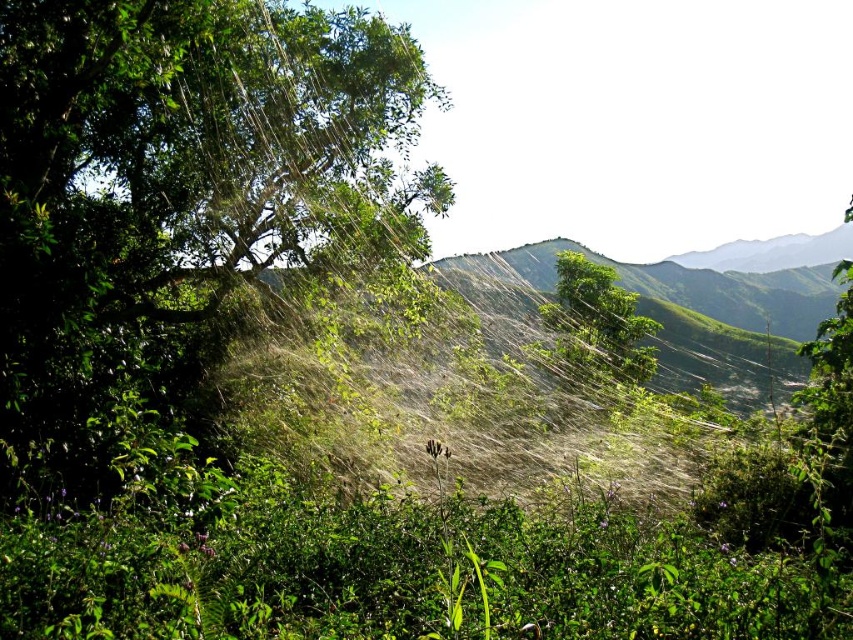
You are standing at the center of the image and see the point marked at coordinates [178,195]. What object is located at that point?

The point at coordinates [178,195] corresponds to the green leafy tree at upper left.

You are an observer standing in the lush landscape. You see the green leafy tree at upper left and the green leafy tree at center. Which tree is closer to you?

The green leafy tree at upper left is closer to you because it is in front of the green leafy tree at center.